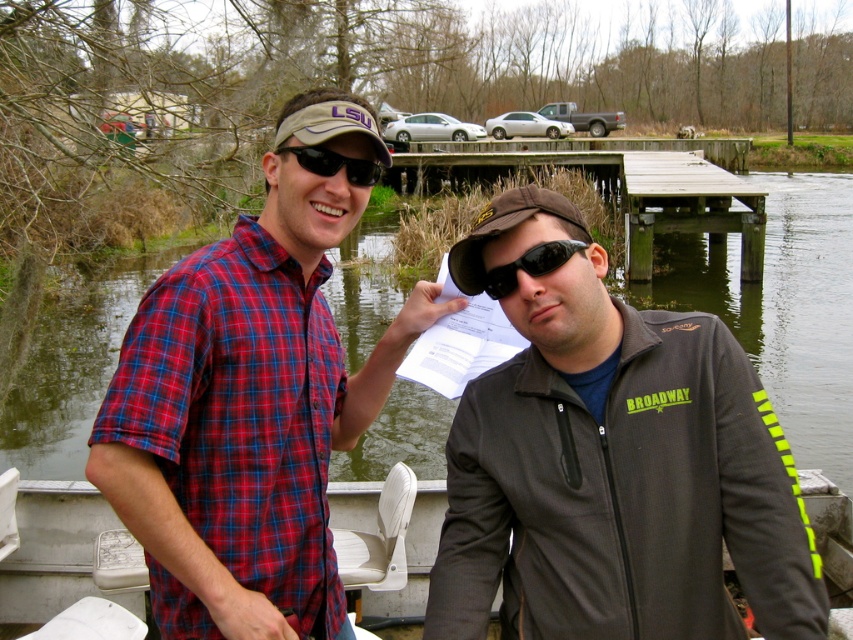
Between point (309, 113) and point (363, 166), which one is positioned in front?

Point (309, 113) is in front.

You are a GUI agent. You are given a task and a screenshot of the screen. Output one action in this format:
    pyautogui.click(x=<x>, y=<y>)
    Task: Click on the matte fabric baseball cap at upper center
    The image size is (853, 640).
    Given the screenshot: What is the action you would take?
    click(x=331, y=124)

Between point (817, 568) and point (842, 438), which one is positioned behind?

Point (842, 438)

Does dark gray softshell jacket at center appear over green water at lower left?

No.

Between point (769, 556) and point (61, 440), which one is positioned behind?

The point (61, 440) is more distant.

Identify the location of dark gray softshell jacket at center. This screenshot has width=853, height=640. (612, 465).

Does dark gray softshell jacket at center have a smaller size compared to plaid cotton shirt at center?

Indeed, dark gray softshell jacket at center has a smaller size compared to plaid cotton shirt at center.

Locate an element on the screen. Image resolution: width=853 pixels, height=640 pixels. dark gray softshell jacket at center is located at coordinates (612, 465).

Find the location of a particular element. The height and width of the screenshot is (640, 853). dark gray softshell jacket at center is located at coordinates (612, 465).

The image size is (853, 640). I want to click on dark gray softshell jacket at center, so (612, 465).